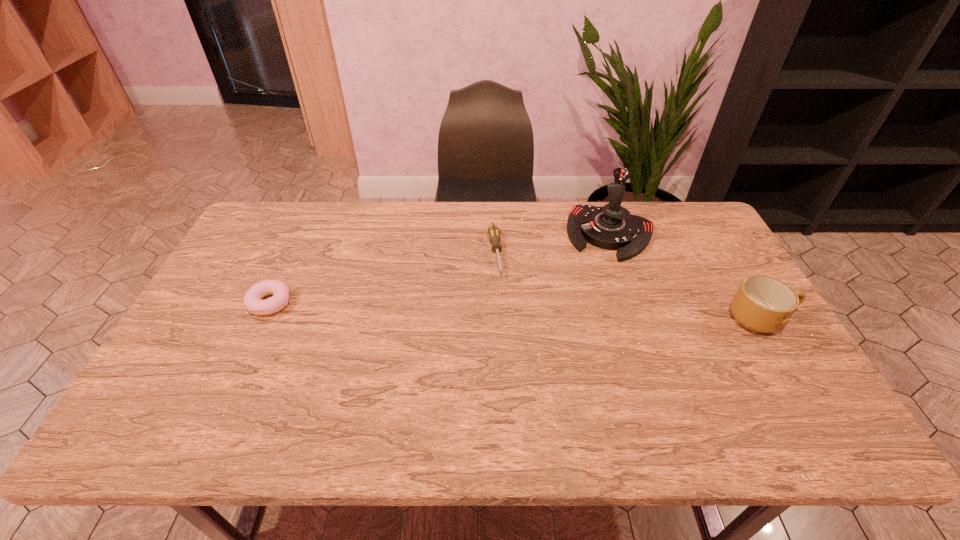
This screenshot has height=540, width=960. Find the location of `vacant space at the right edge of the desktop`. vacant space at the right edge of the desktop is located at coordinates (716, 269).

Where is `vacant space at the far left corner of the desktop`? Image resolution: width=960 pixels, height=540 pixels. vacant space at the far left corner of the desktop is located at coordinates (267, 203).

The image size is (960, 540). In the image, there is a desktop. In order to click on vacant space at the far right corner in this screenshot , I will do `click(718, 242)`.

Locate an element on the screen. Image resolution: width=960 pixels, height=540 pixels. free space at the near right corner is located at coordinates (736, 375).

Locate an element on the screen. The height and width of the screenshot is (540, 960). empty location between the doughnut and the third object from left to right is located at coordinates (441, 268).

Identify the location of free space that is in between the leftmost object and the third object from right to left. This screenshot has height=540, width=960. (383, 278).

What are the coordinates of `vacant region between the third object from right to left and the rightmost object` in the screenshot? It's located at (628, 286).

You are a GUI agent. You are given a task and a screenshot of the screen. Output one action in this format:
    pyautogui.click(x=<x>, y=<y>)
    Task: Click on the vacant space that's between the doughnut and the third object from right to left
    The height and width of the screenshot is (540, 960).
    Given the screenshot: What is the action you would take?
    pyautogui.click(x=383, y=278)

I want to click on vacant area between the screwdriver and the joystick, so click(x=553, y=244).

Find the location of a particular element. The image size is (960, 540). free spot between the third object from left to right and the third object from right to left is located at coordinates (553, 244).